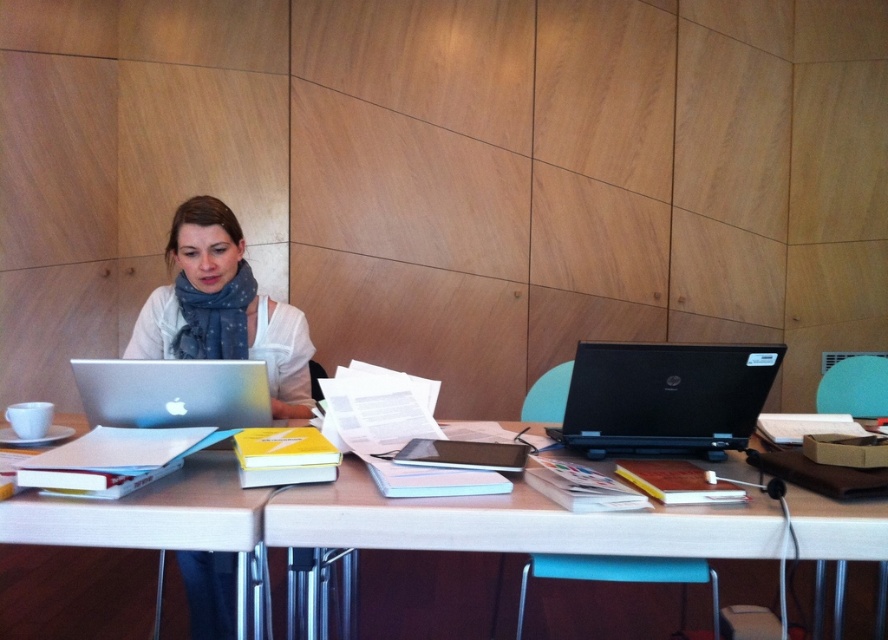
Question: Is white glossy table at lower left thinner than black matte laptop at right?

Choices:
 (A) no
 (B) yes

Answer: (A)

Question: Which object is positioned farthest from the matte white scarf at upper left?

Choices:
 (A) white glossy table at lower left
 (B) black matte laptop at right

Answer: (A)

Question: Does white matte table at center appear under black matte laptop at right?

Choices:
 (A) yes
 (B) no

Answer: (A)

Question: Where is white glossy table at lower left located in relation to matte white scarf at upper left in the image?

Choices:
 (A) left
 (B) right

Answer: (A)

Question: Which point is farther from the camera taking this photo?

Choices:
 (A) 686,378
 (B) 175,493
 (C) 366,525

Answer: (A)

Question: Considering the real-world distances, which object is closest to the matte white scarf at upper left?

Choices:
 (A) white glossy table at lower left
 (B) black matte laptop at right

Answer: (B)